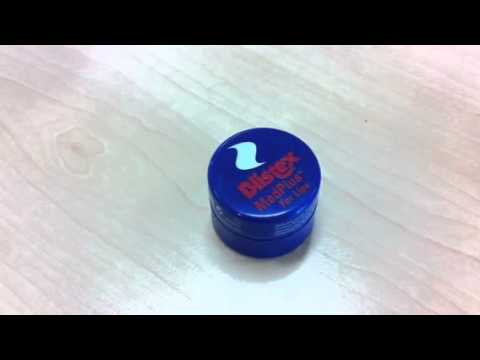
Locate an element on the screen. The image size is (480, 360). white wooden surface is located at coordinates (410, 137).